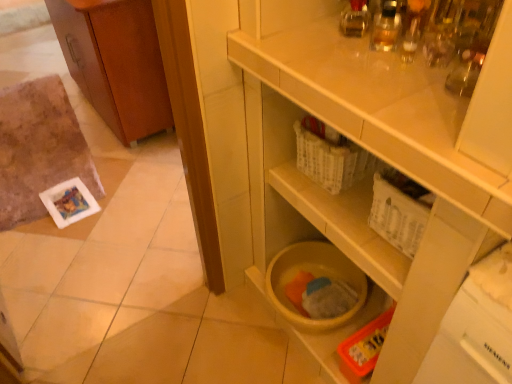
Question: Can you confirm if yellow matte plastic bucket at lower center is thinner than wooden cabinet at left?

Choices:
 (A) yes
 (B) no

Answer: (B)

Question: From the image's perspective, is yellow matte plastic bucket at lower center below wooden cabinet at left?

Choices:
 (A) yes
 (B) no

Answer: (A)

Question: Is yellow matte plastic bucket at lower center further to camera compared to wooden cabinet at left?

Choices:
 (A) no
 (B) yes

Answer: (A)

Question: From the image's perspective, is yellow matte plastic bucket at lower center over wooden cabinet at left?

Choices:
 (A) yes
 (B) no

Answer: (B)

Question: Does yellow matte plastic bucket at lower center have a greater width compared to wooden cabinet at left?

Choices:
 (A) no
 (B) yes

Answer: (B)

Question: Is yellow matte plastic bucket at lower center smaller than wooden cabinet at left?

Choices:
 (A) yes
 (B) no

Answer: (B)

Question: Can you confirm if wooden cabinet at left is positioned to the right of white plastic drawer at upper right?

Choices:
 (A) yes
 (B) no

Answer: (B)

Question: Is the position of wooden cabinet at left more distant than that of white plastic drawer at upper right?

Choices:
 (A) yes
 (B) no

Answer: (A)

Question: From the image's perspective, is wooden cabinet at left located beneath white plastic drawer at upper right?

Choices:
 (A) no
 (B) yes

Answer: (A)

Question: Is wooden cabinet at left completely or partially outside of white plastic drawer at upper right?

Choices:
 (A) yes
 (B) no

Answer: (A)

Question: Is wooden cabinet at left closer to the viewer compared to white plastic drawer at upper right?

Choices:
 (A) yes
 (B) no

Answer: (B)

Question: Is white plastic drawer at upper right at the back of wooden cabinet at left?

Choices:
 (A) yes
 (B) no

Answer: (B)

Question: Considering the relative sizes of white plastic drawer at upper right and wooden cabinet at left in the image provided, is white plastic drawer at upper right shorter than wooden cabinet at left?

Choices:
 (A) no
 (B) yes

Answer: (B)